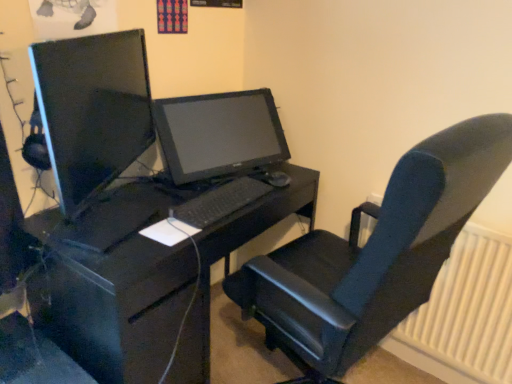
Question: From the image's perspective, would you say matte black monitor at left is positioned over velvet-like black chair at center?

Choices:
 (A) no
 (B) yes

Answer: (B)

Question: Considering the relative sizes of matte black monitor at left and velvet-like black chair at center in the image provided, is matte black monitor at left taller than velvet-like black chair at center?

Choices:
 (A) no
 (B) yes

Answer: (A)

Question: From a real-world perspective, is matte black monitor at left positioned over velvet-like black chair at center based on gravity?

Choices:
 (A) no
 (B) yes

Answer: (B)

Question: Is matte black monitor at left beside velvet-like black chair at center?

Choices:
 (A) no
 (B) yes

Answer: (A)

Question: Is matte black monitor at left to the right of velvet-like black chair at center from the viewer's perspective?

Choices:
 (A) yes
 (B) no

Answer: (B)

Question: In terms of size, does white plastic radiator at right appear bigger or smaller than black matte desk at center?

Choices:
 (A) small
 (B) big

Answer: (A)

Question: Considering the positions of white plastic radiator at right and black matte desk at center in the image, is white plastic radiator at right wider or thinner than black matte desk at center?

Choices:
 (A) thin
 (B) wide

Answer: (A)

Question: Considering their positions, is white plastic radiator at right located in front of or behind black matte desk at center?

Choices:
 (A) behind
 (B) front

Answer: (A)

Question: From their relative heights in the image, would you say white plastic radiator at right is taller or shorter than black matte desk at center?

Choices:
 (A) tall
 (B) short

Answer: (B)

Question: In the image, is black matte keyboard at center positioned in front of or behind white plastic radiator at right?

Choices:
 (A) behind
 (B) front

Answer: (B)

Question: Considering the positions of point (188, 208) and point (416, 360), is point (188, 208) closer or farther from the camera than point (416, 360)?

Choices:
 (A) closer
 (B) farther

Answer: (A)

Question: Considering the relative positions of black matte keyboard at center and white plastic radiator at right in the image provided, is black matte keyboard at center to the left or to the right of white plastic radiator at right?

Choices:
 (A) right
 (B) left

Answer: (B)

Question: From their relative heights in the image, would you say black matte keyboard at center is taller or shorter than white plastic radiator at right?

Choices:
 (A) tall
 (B) short

Answer: (B)

Question: In terms of size, does black matte desk at center appear bigger or smaller than matte black monitor at left?

Choices:
 (A) small
 (B) big

Answer: (B)

Question: Is black matte desk at center in front of or behind matte black monitor at left in the image?

Choices:
 (A) behind
 (B) front

Answer: (A)